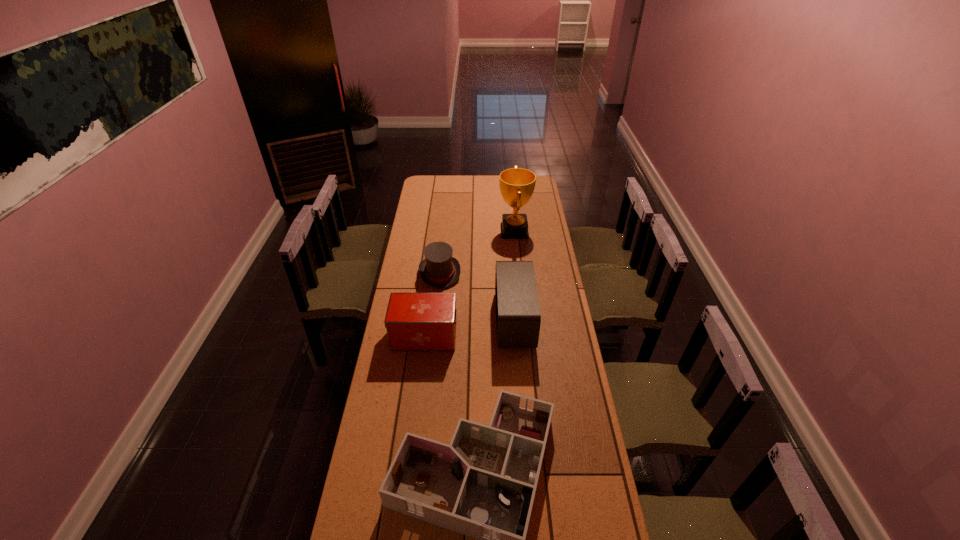
The width and height of the screenshot is (960, 540). What are the coordinates of `free spot located 0.360m on the front-facing side of the radio receiver` in the screenshot? It's located at (417, 320).

Where is `vacant space located on the front-facing side of the radio receiver`? Image resolution: width=960 pixels, height=540 pixels. vacant space located on the front-facing side of the radio receiver is located at coordinates (458, 320).

Where is `blank area located 0.130m on the handle side of the third shortest object`? This screenshot has height=540, width=960. blank area located 0.130m on the handle side of the third shortest object is located at coordinates (488, 336).

Find the location of a particular element. vacant region located on the back of the second farthest object is located at coordinates (443, 248).

Where is `the first-aid kit that is at the left edge`? the first-aid kit that is at the left edge is located at coordinates (414, 321).

Find the location of a particular element. This screenshot has height=540, width=960. dress hat located in the left edge section of the desktop is located at coordinates (439, 269).

Locate an element on the screen. award that is at the right edge is located at coordinates (517, 185).

You are a GUI agent. You are given a task and a screenshot of the screen. Output one action in this format:
    pyautogui.click(x=<x>, y=<y>)
    Task: Click on the radio receiver present at the right edge
    The height and width of the screenshot is (540, 960).
    Given the screenshot: What is the action you would take?
    pyautogui.click(x=518, y=319)

Image resolution: width=960 pixels, height=540 pixels. I want to click on free space at the far edge of the desktop, so click(492, 192).

You are a GUI agent. You are given a task and a screenshot of the screen. Output one action in this format:
    pyautogui.click(x=<x>, y=<y>)
    Task: Click on the blank space at the left edge of the desktop
    This screenshot has width=960, height=540.
    Given the screenshot: What is the action you would take?
    pyautogui.click(x=387, y=354)